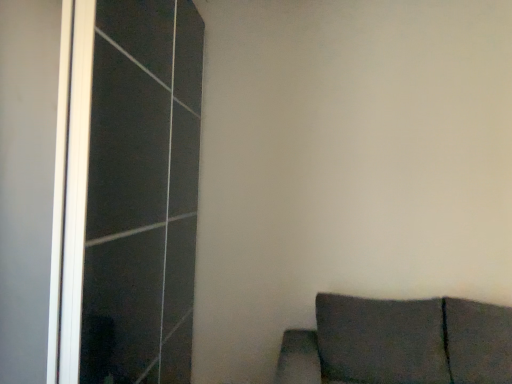
Question: Should I look upward or downward to see transparent glass screen door at left?

Choices:
 (A) up
 (B) down

Answer: (B)

Question: From a real-world perspective, is dark fabric couch at lower right beneath transparent glass screen door at left?

Choices:
 (A) yes
 (B) no

Answer: (A)

Question: Is dark fabric couch at lower right in contact with transparent glass screen door at left?

Choices:
 (A) no
 (B) yes

Answer: (A)

Question: Does dark fabric couch at lower right lie in front of transparent glass screen door at left?

Choices:
 (A) yes
 (B) no

Answer: (A)

Question: Does dark fabric couch at lower right have a lesser height compared to transparent glass screen door at left?

Choices:
 (A) no
 (B) yes

Answer: (B)

Question: From the image's perspective, is dark fabric couch at lower right under transparent glass screen door at left?

Choices:
 (A) no
 (B) yes

Answer: (B)

Question: Considering the relative positions of dark fabric couch at lower right and transparent glass screen door at left in the image provided, is dark fabric couch at lower right to the right of transparent glass screen door at left from the viewer's perspective?

Choices:
 (A) yes
 (B) no

Answer: (A)

Question: Is transparent glass screen door at left facing towards dark fabric couch at lower right?

Choices:
 (A) no
 (B) yes

Answer: (B)

Question: From a real-world perspective, is transparent glass screen door at left physically below dark fabric couch at lower right?

Choices:
 (A) no
 (B) yes

Answer: (A)

Question: From a real-world perspective, is transparent glass screen door at left over dark fabric couch at lower right?

Choices:
 (A) no
 (B) yes

Answer: (B)

Question: Is transparent glass screen door at left oriented away from dark fabric couch at lower right?

Choices:
 (A) yes
 (B) no

Answer: (B)

Question: Can you confirm if transparent glass screen door at left is thinner than dark fabric couch at lower right?

Choices:
 (A) no
 (B) yes

Answer: (B)

Question: Considering the relative sizes of transparent glass screen door at left and dark fabric couch at lower right in the image provided, is transparent glass screen door at left taller than dark fabric couch at lower right?

Choices:
 (A) yes
 (B) no

Answer: (A)

Question: Considering the positions of point (68, 92) and point (433, 332), is point (68, 92) closer or farther from the camera than point (433, 332)?

Choices:
 (A) farther
 (B) closer

Answer: (B)